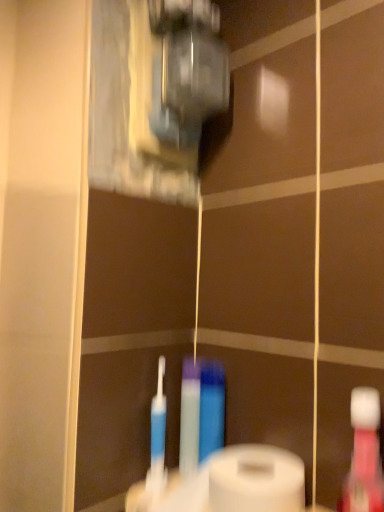
Question: In the image, is white matte toilet paper at lower center on the left side or the right side of translucent plastic mouthwash at right?

Choices:
 (A) right
 (B) left

Answer: (B)

Question: Looking at the image, does white matte toilet paper at lower center seem bigger or smaller compared to translucent plastic mouthwash at right?

Choices:
 (A) small
 (B) big

Answer: (B)

Question: Considering their positions, is white matte toilet paper at lower center located in front of or behind translucent plastic mouthwash at right?

Choices:
 (A) front
 (B) behind

Answer: (B)

Question: Looking at their shapes, would you say translucent plastic mouthwash at right is wider or thinner than white matte toilet paper at lower center?

Choices:
 (A) wide
 (B) thin

Answer: (B)

Question: Is translucent plastic mouthwash at right in front of or behind white matte toilet paper at lower center in the image?

Choices:
 (A) front
 (B) behind

Answer: (A)

Question: In the image, is translucent plastic mouthwash at right on the left side or the right side of white matte toilet paper at lower center?

Choices:
 (A) left
 (B) right

Answer: (B)

Question: From a real-world perspective, is translucent plastic mouthwash at right physically located above or below white matte toilet paper at lower center?

Choices:
 (A) above
 (B) below

Answer: (A)